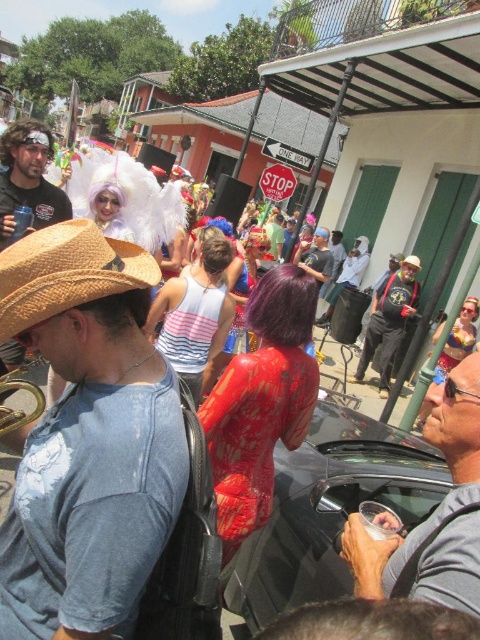
Is matte black t-shirt at upper left to the right of matte red shirt at center from the viewer's perspective?

In fact, matte black t-shirt at upper left is to the left of matte red shirt at center.

Which of these two, matte black t-shirt at upper left or matte red shirt at center, stands shorter?

Standing shorter between the two is matte black t-shirt at upper left.

Does point (55, 204) come in front of point (284, 257)?

Yes.

This screenshot has height=640, width=480. What are the coordinates of `matte black t-shirt at upper left` in the screenshot? It's located at (28, 179).

Between matte green shirt at center and brown straw hat at center, which one is positioned higher?

matte green shirt at center

Measure the distance between matte green shirt at center and brown straw hat at center.

The distance of matte green shirt at center from brown straw hat at center is 6.85 meters.

Which is behind, point (268, 237) or point (411, 256)?

The point (268, 237) is more distant.

This screenshot has height=640, width=480. I want to click on matte green shirt at center, so click(x=275, y=236).

How far apart are matte black sunglasses at center and matte black t-shirt at upper left?

A distance of 3.61 meters exists between matte black sunglasses at center and matte black t-shirt at upper left.

Based on the photo, is matte black sunglasses at center smaller than matte black t-shirt at upper left?

Correct, matte black sunglasses at center occupies less space than matte black t-shirt at upper left.

Is point (424, 584) in front of point (10, 173)?

That is True.

The height and width of the screenshot is (640, 480). I want to click on matte black sunglasses at center, so click(445, 496).